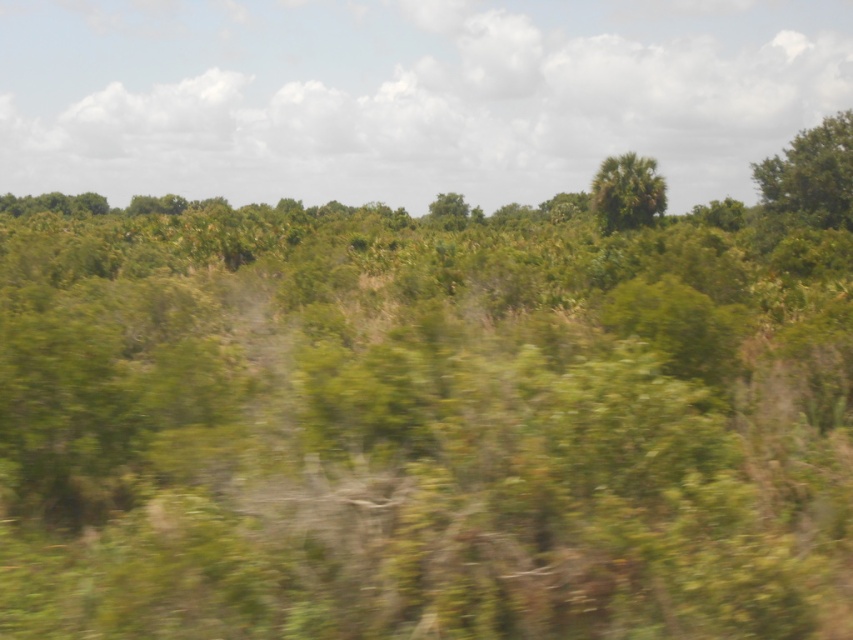
Question: Which point appears closest to the camera in this image?

Choices:
 (A) (838, 116)
 (B) (640, 173)

Answer: (A)

Question: Is green leafy tree at upper right closer to camera compared to green leafy palm at upper center?

Choices:
 (A) yes
 (B) no

Answer: (A)

Question: Is green leafy tree at upper right closer to the viewer compared to green leafy palm at upper center?

Choices:
 (A) no
 (B) yes

Answer: (B)

Question: Which object is positioned farthest from the green leafy tree at upper right?

Choices:
 (A) green leafy palm at upper center
 (B) green leafy tree at center

Answer: (B)

Question: Does green leafy palm at upper center appear over green leafy tree at center?

Choices:
 (A) no
 (B) yes

Answer: (A)

Question: Among these objects, which one is farthest from the camera?

Choices:
 (A) green leafy tree at upper right
 (B) green leafy tree at center
 (C) green leafy palm at upper center

Answer: (B)